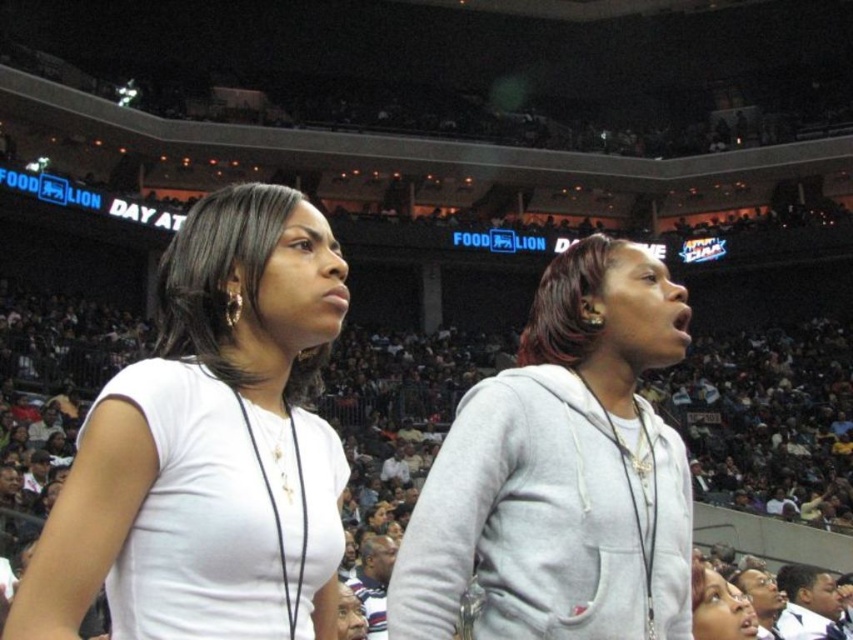
From the picture: You are a photographer trying to capture a candid shot of both the white matte shirt at center and the gray hoodie at center. Since you want to ensure both are in focus, which one should you focus on first considering their positions?

The white matte shirt at center is closer to the viewer than the gray hoodie at center, so you should focus on the white matte shirt at center first to ensure both are in focus.

You are a photographer trying to capture a clear shot of both the white matte shirt at center and the gray hoodie at center in the arena. Since you want to ensure both are visible, which clothing item should you focus on first to make sure it stands out in the photo?

The white matte shirt at center is larger than the gray hoodie at center, so focusing on it first will ensure it stands out and remains visible in the photo.